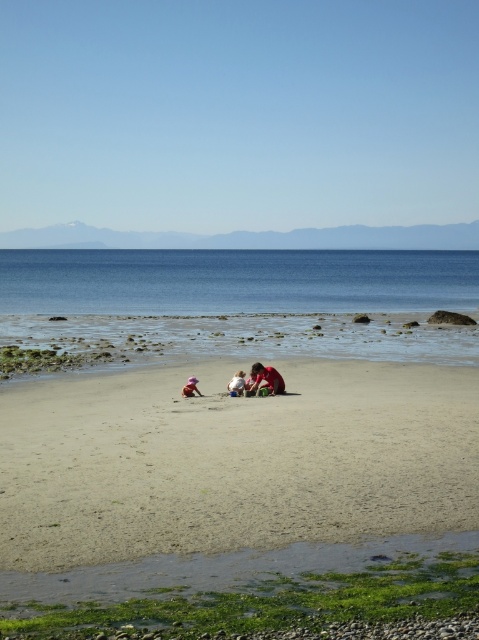
Question: Does matte red shirt at center have a greater width compared to pink fabric at center?

Choices:
 (A) no
 (B) yes

Answer: (A)

Question: Which point is farther to the camera?

Choices:
 (A) matte red shirt at center
 (B) pink fabric at center
 (C) blue smooth water at center
 (D) light brown sand at center

Answer: (C)

Question: Is blue smooth water at center bigger than pink fabric at center?

Choices:
 (A) yes
 (B) no

Answer: (A)

Question: Which is farther from the light brown sand at center?

Choices:
 (A) matte red shirt at center
 (B) pink fabric at center
 (C) blue smooth water at center
 (D) reddish-orange fabric at center

Answer: (C)

Question: Is light brown sand at center above pink fabric at center?

Choices:
 (A) no
 (B) yes

Answer: (A)

Question: Which of these objects is positioned closest to the reddish-orange fabric at center?

Choices:
 (A) matte red shirt at center
 (B) pink fabric at center
 (C) blue smooth water at center
 (D) light brown sand at center

Answer: (A)